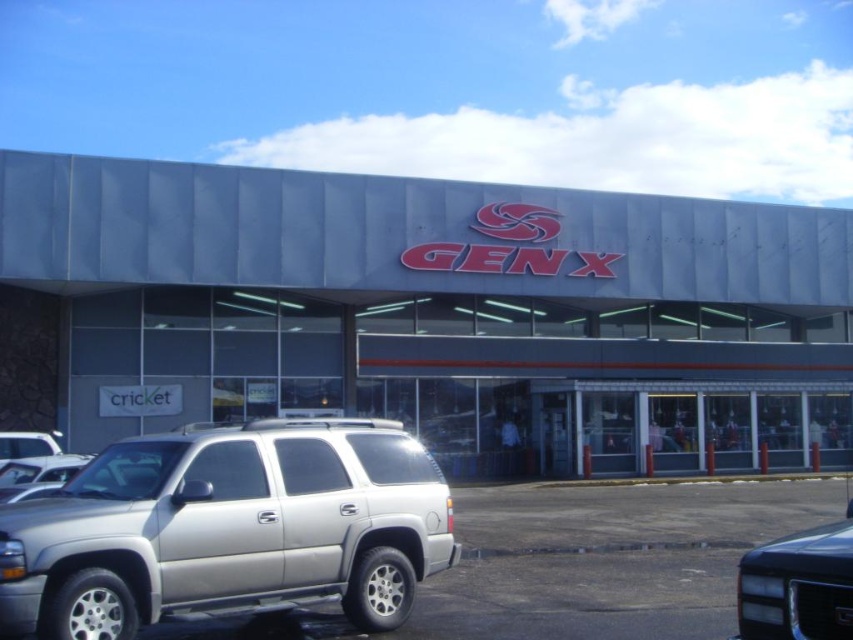
You are standing in front of the gray metallic storefront at center and want to walk to the shiny black suv at lower right. Which direction should you move relative to the storefront?

You should move towards the lower right direction from the gray metallic storefront at center to reach the shiny black suv at lower right, as the suv is positioned further away from the viewer compared to the storefront.

You are a delivery driver who needs to park your truck between the silver metallic minivan at lower left and the shiny black suv at lower right. Based on the scene, will your truck fit between them if it is 2 meters wide?

The silver metallic minivan at lower left is thinner than the shiny black suv at lower right. However, the exact distance between them isn not provided in the objects description. Therefore, it is uncertain whether a 2 meter wide truck can fit between them without additional information about the space available.